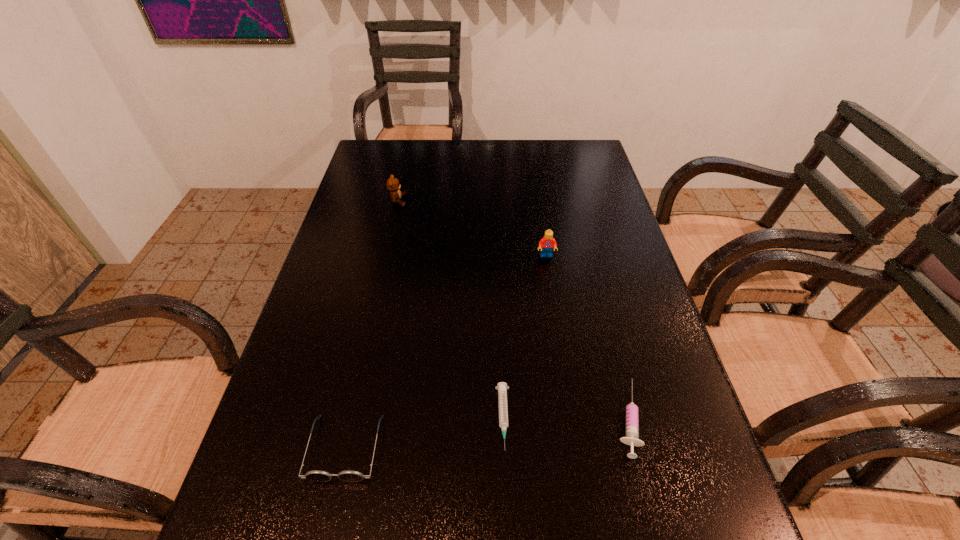
You are a GUI agent. You are given a task and a screenshot of the screen. Output one action in this format:
    pyautogui.click(x=<x>, y=<y>)
    Task: Click on the vacant space located on the front-facing side of the sunglasses
    
    Given the screenshot: What is the action you would take?
    click(329, 521)

This screenshot has height=540, width=960. I want to click on vacant position located on the left of the right syringe, so click(526, 418).

Locate an element on the screen. The height and width of the screenshot is (540, 960). blank area located 0.080m at the needle end of the third object from left to right is located at coordinates (507, 499).

Image resolution: width=960 pixels, height=540 pixels. I want to click on teddy bear that is at the left edge, so 393,186.

Where is `sunglasses positioned at the left edge`? Image resolution: width=960 pixels, height=540 pixels. sunglasses positioned at the left edge is located at coordinates (316, 475).

The height and width of the screenshot is (540, 960). I want to click on object positioned at the right edge, so click(x=632, y=411).

This screenshot has height=540, width=960. Find the location of `free space at the far edge of the desktop`. free space at the far edge of the desktop is located at coordinates pos(431,148).

The width and height of the screenshot is (960, 540). In order to click on free space at the left edge of the desktop in this screenshot , I will do `click(370, 326)`.

You are a GUI agent. You are given a task and a screenshot of the screen. Output one action in this format:
    pyautogui.click(x=<x>, y=<y>)
    Task: Click on the free spot at the right edge of the desktop
    
    Given the screenshot: What is the action you would take?
    pyautogui.click(x=600, y=199)

Where is `vacant space at the far left corner`? This screenshot has width=960, height=540. vacant space at the far left corner is located at coordinates (368, 153).